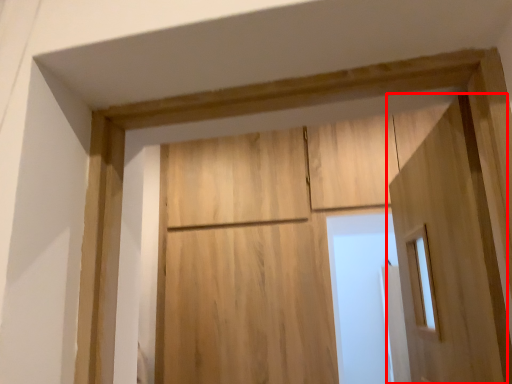
Question: Where is door (annotated by the red box) located in relation to barn door in the image?

Choices:
 (A) right
 (B) left

Answer: (A)